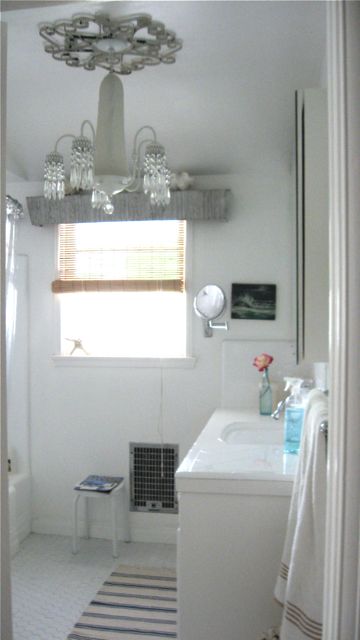
The height and width of the screenshot is (640, 360). What are the coordinates of `rug` in the screenshot? It's located at (151, 620).